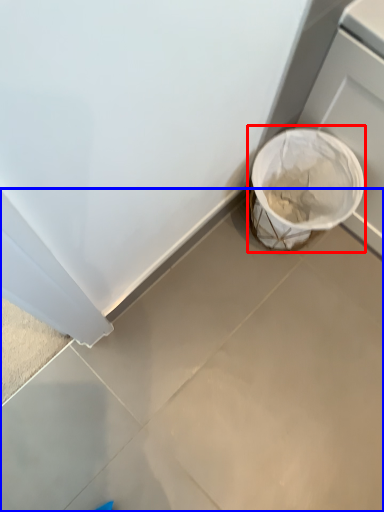
Question: Which object is closer to the camera taking this photo, waste container (highlighted by a red box) or concrete (highlighted by a blue box)?

Choices:
 (A) waste container
 (B) concrete

Answer: (B)